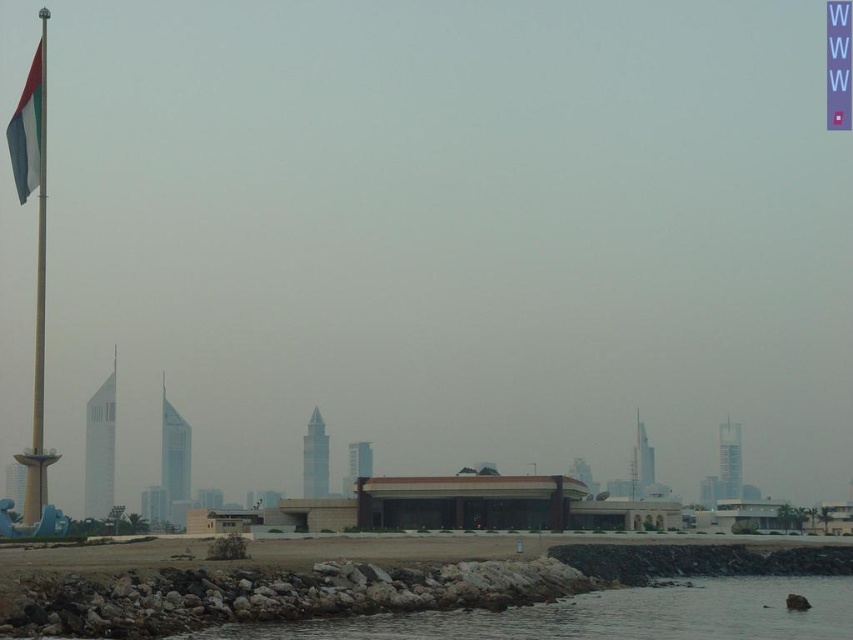
You are standing at the shoreline looking towards the flagpole and the building. There are two points marked on the ground in front of you. One is at coordinate point (22, 520) and the other is at point (25, 157). Which point is closer to your current position?

Point (22, 520) is closer to the camera than point (25, 157), so the point at (22, 520) is closer to your current position.

You are a photographer standing at the water edge in this scene. You want to take a photo that includes both the flagpole and the low building. The flagpole is located at point (657, 605) and the building at point (25, 195). Since you can only focus on one point at a time, which point should you focus on to ensure the flagpole is in focus?

You should focus on point (657, 605) because it is closer to the camera than point (25, 195), ensuring the flagpole is in focus.